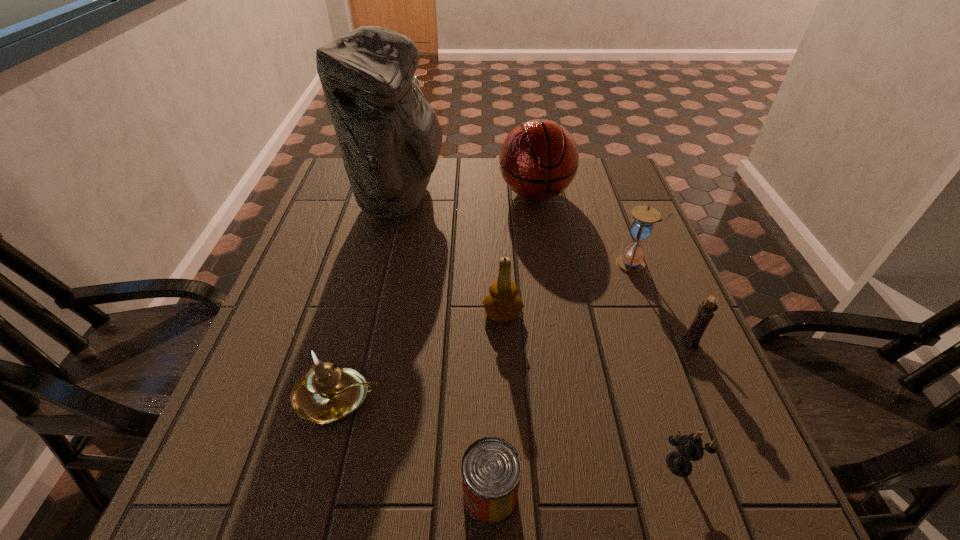
At what (x,y) coordinates should I click in order to perform the action: click on vacant area between the leftmost candle holder and the seventh shortest object. Please return your answer as a coordinate pair (x, y). The height and width of the screenshot is (540, 960). Looking at the image, I should click on (436, 295).

Find the location of a particular element. free space between the second farthest candle holder and the tallest object is located at coordinates (544, 270).

Find the location of `free space between the nearest candle holder and the leftmost candle holder`. free space between the nearest candle holder and the leftmost candle holder is located at coordinates (508, 430).

You are a GUI agent. You are given a task and a screenshot of the screen. Output one action in this format:
    pyautogui.click(x=<x>, y=<y>)
    Task: Click on the free space between the leftmost candle holder and the basketball
    This screenshot has height=540, width=960.
    Given the screenshot: What is the action you would take?
    pyautogui.click(x=436, y=295)

Find the location of a particular element. The image size is (960, 540). vacant space that is in between the rightmost candle holder and the farthest candle holder is located at coordinates (596, 327).

The width and height of the screenshot is (960, 540). What are the coordinates of `object identified as the closest to the tallest object` in the screenshot? It's located at (539, 159).

Identify which object is located as the fourth nearest to the hourglass. Please provide its 2D coordinates. Your answer should be formatted as a tuple, i.e. [(x, y)], where the tuple contains the x and y coordinates of a point satisfying the conditions above.

[(689, 448)]

Locate which candle holder is the third closest to the leftmost candle holder. Please provide its 2D coordinates. Your answer should be formatted as a tuple, i.e. [(x, y)], where the tuple contains the x and y coordinates of a point satisfying the conditions above.

[(706, 309)]

Select which candle holder is the third closest to the farthest candle holder. Please provide its 2D coordinates. Your answer should be formatted as a tuple, i.e. [(x, y)], where the tuple contains the x and y coordinates of a point satisfying the conditions above.

[(689, 448)]

Locate an element on the screen. The width and height of the screenshot is (960, 540). free space that satisfies the following two spatial constraints: 1. on the front-facing side of the backpack; 2. on the right side of the fourth nearest object is located at coordinates (366, 342).